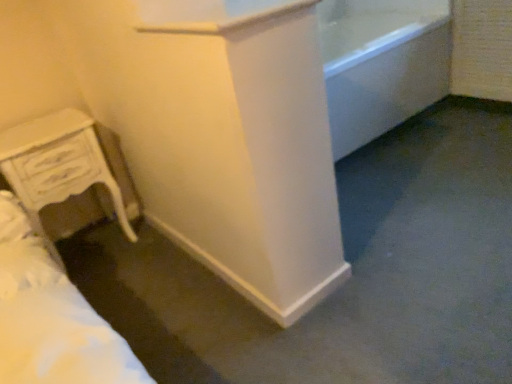
Measure the distance between point (380,106) and camera.

Point (380,106) and camera are 7.83 feet apart from each other.

Describe the element at coordinates (381, 64) in the screenshot. I see `white glossy bathtub at upper right` at that location.

Measure the distance between white glossy bathtub at upper right and camera.

white glossy bathtub at upper right and camera are 6.69 feet apart.

This screenshot has height=384, width=512. I want to click on white glossy bathtub at upper right, so click(x=381, y=64).

The image size is (512, 384). What do you see at coordinates (58, 163) in the screenshot?
I see `white wood chest of drawers at lower left` at bounding box center [58, 163].

Where is `white wood chest of drawers at lower left`? The height and width of the screenshot is (384, 512). white wood chest of drawers at lower left is located at coordinates (58, 163).

In order to face white wood chest of drawers at lower left, should I rotate leftwards or rightwards?

You should look left and rotate roughly 24.159 degrees.

Find the location of a particular element. The image size is (512, 384). white glossy bathtub at upper right is located at coordinates (381, 64).

Visually, is white glossy bathtub at upper right positioned to the left or to the right of white wood chest of drawers at lower left?

In the image, white glossy bathtub at upper right appears on the right side of white wood chest of drawers at lower left.

Which object is further away from the camera, white glossy bathtub at upper right or white wood chest of drawers at lower left?

Positioned behind is white glossy bathtub at upper right.

Which is behind, point (433, 23) or point (96, 136)?

Positioned behind is point (433, 23).

From the image's perspective, does white glossy bathtub at upper right appear higher than white wood chest of drawers at lower left?

Yes, from the image's perspective, white glossy bathtub at upper right is above white wood chest of drawers at lower left.

Based on the photo, from a real-world perspective, which is physically below, white glossy bathtub at upper right or white wood chest of drawers at lower left?

white glossy bathtub at upper right.

Is white glossy bathtub at upper right wider or thinner than white wood chest of drawers at lower left?

Considering their sizes, white glossy bathtub at upper right looks broader than white wood chest of drawers at lower left.

Does white glossy bathtub at upper right have a lesser height compared to white wood chest of drawers at lower left?

Indeed, white glossy bathtub at upper right has a lesser height compared to white wood chest of drawers at lower left.

Is white glossy bathtub at upper right bigger than white wood chest of drawers at lower left?

Yes.

Is white glossy bathtub at upper right located outside white wood chest of drawers at lower left?

Yes.

Is white glossy bathtub at upper right positioned far away from white wood chest of drawers at lower left?

white glossy bathtub at upper right is far away from white wood chest of drawers at lower left.

Is white glossy bathtub at upper right positioned with its back to white wood chest of drawers at lower left?

No.

The image size is (512, 384). Identify the location of the chest of drawers above the white glossy bathtub at upper right (from a real-world perspective). (58, 163).

Considering the relative positions of white wood chest of drawers at lower left and white glossy bathtub at upper right in the image provided, is white wood chest of drawers at lower left to the left or to the right of white glossy bathtub at upper right?

Clearly, white wood chest of drawers at lower left is on the left of white glossy bathtub at upper right in the image.

Relative to white glossy bathtub at upper right, is white wood chest of drawers at lower left in front or behind?

Visually, white wood chest of drawers at lower left is located in front of white glossy bathtub at upper right.

Which is behind, point (62, 116) or point (437, 96)?

Point (437, 96)

From the image's perspective, which object appears higher, white wood chest of drawers at lower left or white glossy bathtub at upper right?

white glossy bathtub at upper right, from the image's perspective.

From a real-world perspective, between white wood chest of drawers at lower left and white glossy bathtub at upper right, who is vertically lower?

white glossy bathtub at upper right.

Considering the sizes of white wood chest of drawers at lower left and white glossy bathtub at upper right in the image, is white wood chest of drawers at lower left wider or thinner than white glossy bathtub at upper right?

Considering their sizes, white wood chest of drawers at lower left looks slimmer than white glossy bathtub at upper right.

From their relative heights in the image, would you say white wood chest of drawers at lower left is taller or shorter than white glossy bathtub at upper right?

In the image, white wood chest of drawers at lower left appears to be taller than white glossy bathtub at upper right.

Considering the sizes of objects white wood chest of drawers at lower left and white glossy bathtub at upper right in the image provided, who is bigger, white wood chest of drawers at lower left or white glossy bathtub at upper right?

With larger size is white glossy bathtub at upper right.

Would you say white wood chest of drawers at lower left is inside or outside white glossy bathtub at upper right?

white wood chest of drawers at lower left is spatially situated outside white glossy bathtub at upper right.

Would you consider white wood chest of drawers at lower left to be distant from white glossy bathtub at upper right?

white wood chest of drawers at lower left is far away from white glossy bathtub at upper right.

Could you tell me if white wood chest of drawers at lower left is facing white glossy bathtub at upper right?

No, white wood chest of drawers at lower left is not oriented towards white glossy bathtub at upper right.

Measure the distance between white wood chest of drawers at lower left and white glossy bathtub at upper right.

The distance of white wood chest of drawers at lower left from white glossy bathtub at upper right is 1.47 meters.

Find the location of `bath below the white wood chest of drawers at lower left (from a real-world perspective)`. bath below the white wood chest of drawers at lower left (from a real-world perspective) is located at coordinates (x=381, y=64).

Image resolution: width=512 pixels, height=384 pixels. I want to click on chest of drawers on the left of the white glossy bathtub at upper right, so click(x=58, y=163).

The height and width of the screenshot is (384, 512). Find the location of `chest of drawers below the white glossy bathtub at upper right (from the image's perspective)`. chest of drawers below the white glossy bathtub at upper right (from the image's perspective) is located at coordinates (58, 163).